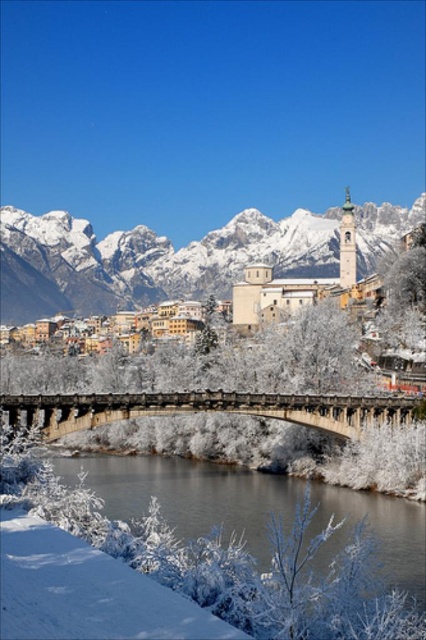
Is white frosted water at lower center thinner than snowy granite mountains at upper center?

Correct, white frosted water at lower center's width is less than snowy granite mountains at upper center's.

Does white frosted water at lower center have a greater height compared to snowy granite mountains at upper center?

No, white frosted water at lower center is not taller than snowy granite mountains at upper center.

This screenshot has width=426, height=640. I want to click on white frosted water at lower center, so click(235, 550).

Find the location of `white frosted water at lower center`. white frosted water at lower center is located at coordinates (235, 550).

Between white frosted water at lower center and concrete bridge at center, which one is positioned lower?

white frosted water at lower center is below.

Is point (204, 593) positioned before point (78, 422)?

Yes.

Image resolution: width=426 pixels, height=640 pixels. In order to click on white frosted water at lower center in this screenshot , I will do `click(235, 550)`.

This screenshot has height=640, width=426. What do you see at coordinates (146, 260) in the screenshot?
I see `snowy granite mountains at upper center` at bounding box center [146, 260].

Is snowy granite mountains at upper center bigger than concrete bridge at center?

Correct, snowy granite mountains at upper center is larger in size than concrete bridge at center.

Is point (46, 308) behind point (149, 396)?

Yes, it is behind point (149, 396).

Image resolution: width=426 pixels, height=640 pixels. In order to click on snowy granite mountains at upper center in this screenshot , I will do `click(146, 260)`.